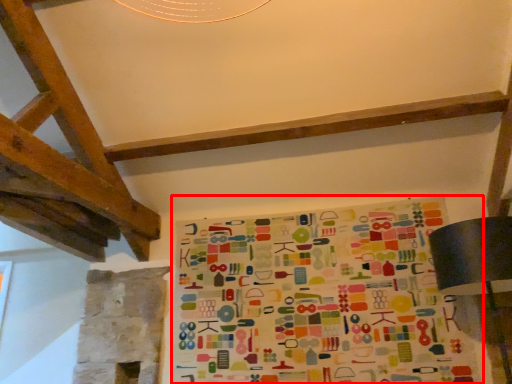
Question: From the image's perspective, what is the correct spatial relationship of bulletin board (annotated by the red box) in relation to table lamp?

Choices:
 (A) below
 (B) above

Answer: (A)